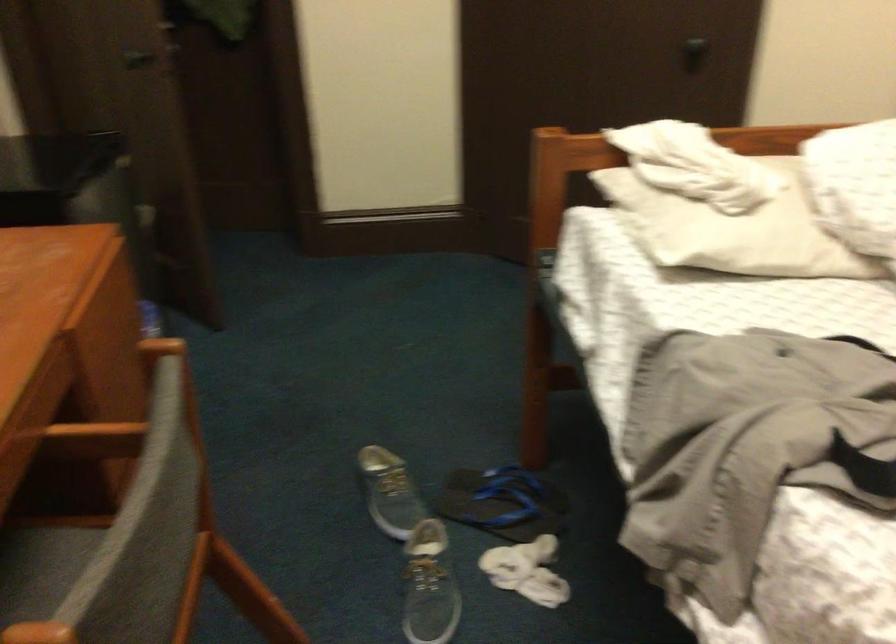
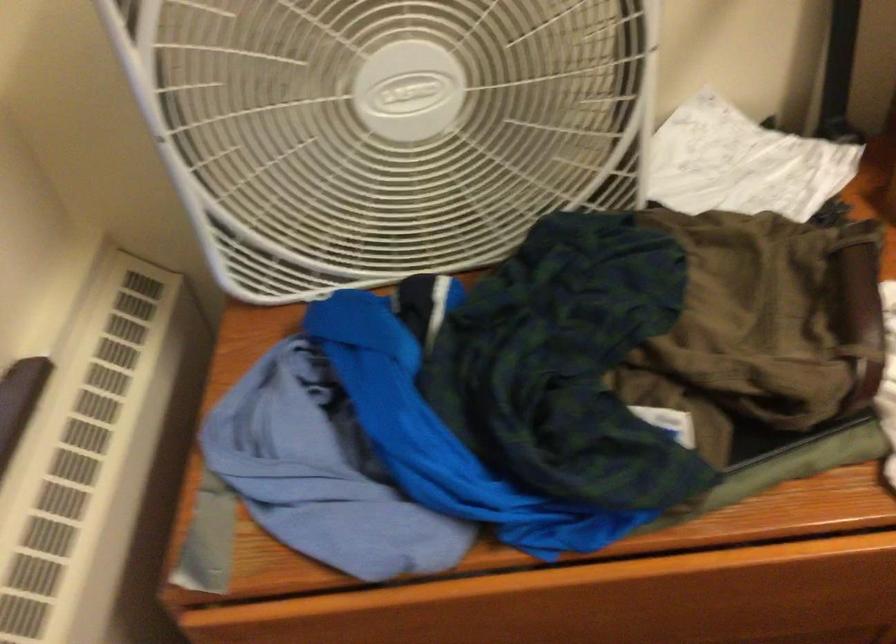
The images are taken continuously from a first-person perspective. In which direction is your viewpoint rotating?

The camera's rotation is toward left-down.